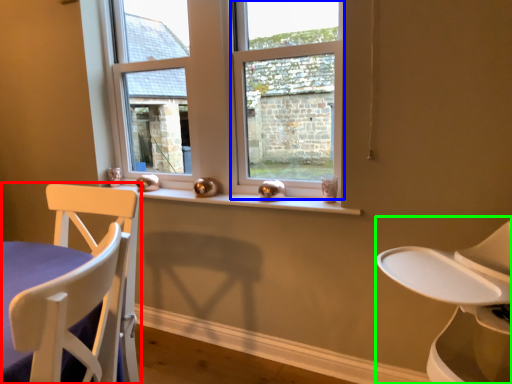
Question: Which object is the closest to the chair (highlighted by a red box)? Choose among these: window (highlighted by a blue box) or feeding chair (highlighted by a green box).

Choices:
 (A) window
 (B) feeding chair

Answer: (B)